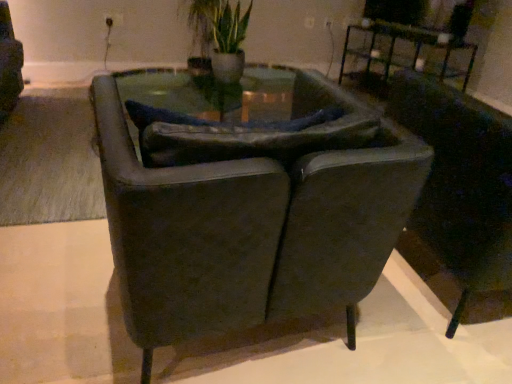
Question: In terms of width, does metallic black table at upper right look wider or thinner when compared to suede-like dark brown armchair at center, the first chair viewed from the left?

Choices:
 (A) wide
 (B) thin

Answer: (B)

Question: In the image, is metallic black table at upper right positioned in front of or behind suede-like dark brown armchair at center, the first chair viewed from the left?

Choices:
 (A) front
 (B) behind

Answer: (B)

Question: Considering the real-world distances, which object is farthest from the green leafy plant at upper center?

Choices:
 (A) metallic black table at upper right
 (B) suede-like dark brown armchair at center, the second chair positioned from the right
 (C) dark leather chair at right, which ranks as the 1th chair in right-to-left order

Answer: (B)

Question: Which object is the closest to the green leafy plant at upper center?

Choices:
 (A) dark leather chair at right, the second chair in the left-to-right sequence
 (B) suede-like dark brown armchair at center, the first chair viewed from the left
 (C) metallic black table at upper right

Answer: (C)